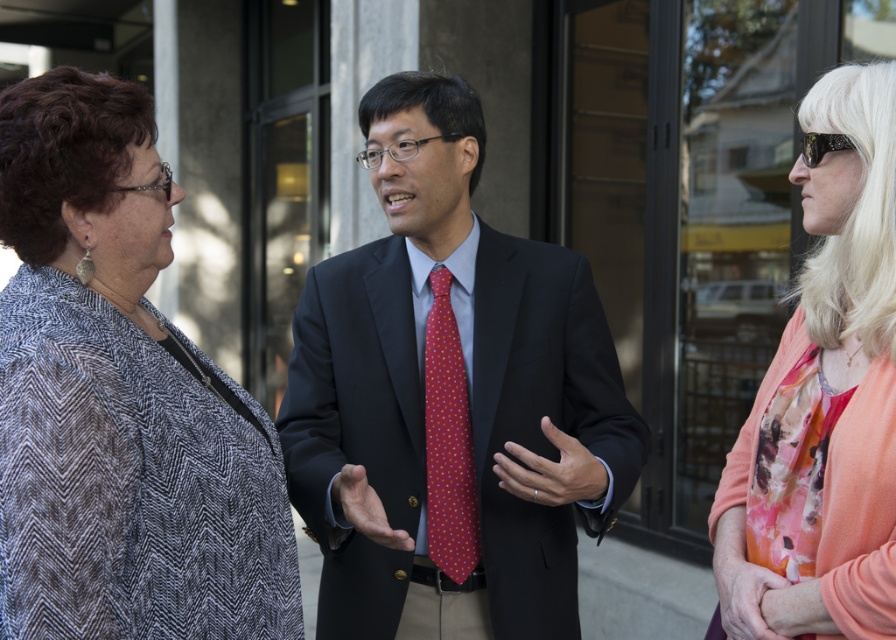
Is matte black suit at center positioned behind polka dot silk tie at center?

No, it is not.

Is matte black suit at center smaller than polka dot silk tie at center?

Actually, matte black suit at center might be larger than polka dot silk tie at center.

Does point (358, 460) lie in front of point (470, 449)?

That is False.

You are a GUI agent. You are given a task and a screenshot of the screen. Output one action in this format:
    pyautogui.click(x=<x>, y=<y>)
    Task: Click on the matte black suit at center
    The height and width of the screenshot is (640, 896).
    Given the screenshot: What is the action you would take?
    pyautogui.click(x=450, y=400)

Which is above, patterned fabric jacket at left or polka dot silk tie at center?

patterned fabric jacket at left

In the scene shown: Does patterned fabric jacket at left appear under polka dot silk tie at center?

No, patterned fabric jacket at left is not below polka dot silk tie at center.

What do you see at coordinates (118, 397) in the screenshot? Image resolution: width=896 pixels, height=640 pixels. I see `patterned fabric jacket at left` at bounding box center [118, 397].

The width and height of the screenshot is (896, 640). I want to click on patterned fabric jacket at left, so click(x=118, y=397).

Can you confirm if floral print blouse at center is wider than polka dot silk tie at center?

Yes, floral print blouse at center is wider than polka dot silk tie at center.

Between point (785, 422) and point (470, 564), which one is positioned behind?

Positioned behind is point (470, 564).

This screenshot has height=640, width=896. In order to click on floral print blouse at center in this screenshot , I will do `click(824, 396)`.